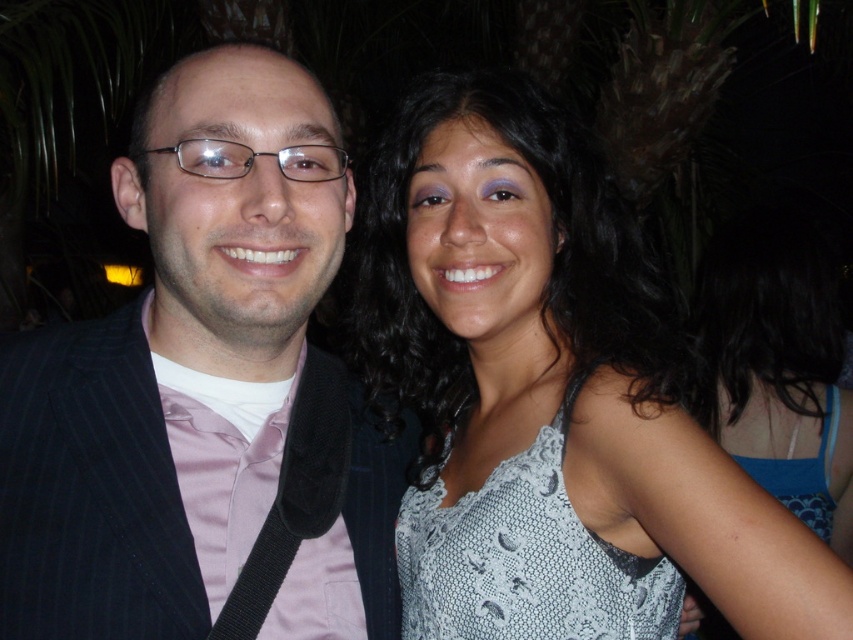
You are a photographer trying to adjust the lighting for a night portrait. The subject is wearing a black pinstripe suit at left. Where should you position the light source to ensure the suit is well lit?

To ensure the black pinstripe suit at left is well lit, position the light source near the area where the suit is located, which is at coordinates approximately 0.614 in the x and 0.240 in the y. This placement will help illuminate the suit effectively in the low light conditions.

You are standing in front of the image and want to determine the position of the white lace tank top at upper right relative to the other person. Can you tell me where it is placed?

The white lace tank top at upper right is located at point [554,397] in the image coordinates.

You are a photographer adjusting the lighting for a night photo shoot. You notice two lace tank tops in the upper right corner of the frame. The white lace tank top at upper right and the blue lace tank top at upper right. Which one is positioned to the left of the other?

The white lace tank top at upper right is positioned to the left of the blue lace tank top at upper right.